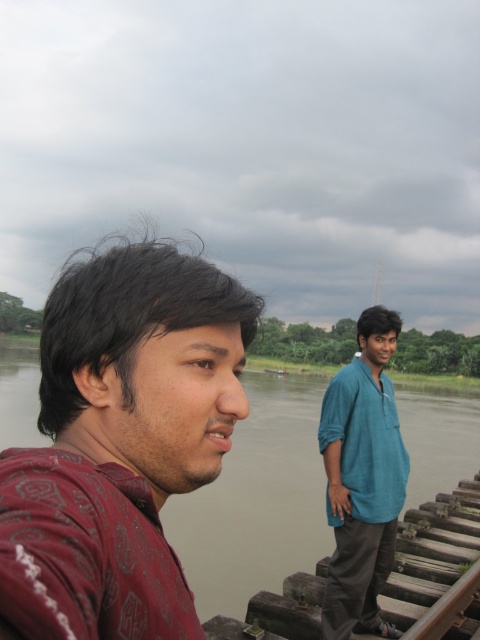
Can you confirm if greenish-brown water at center is positioned above teal cotton shirt at center?

No.

Measure the distance between point [312,561] and camera.

Point [312,561] is 7.48 meters away from camera.

Describe the element at coordinates (256, 500) in the screenshot. This screenshot has width=480, height=640. I see `greenish-brown water at center` at that location.

You are a GUI agent. You are given a task and a screenshot of the screen. Output one action in this format:
    pyautogui.click(x=<x>, y=<y>)
    Task: Click on the greenish-brown water at center
    Image resolution: width=480 pixels, height=640 pixels.
    Given the screenshot: What is the action you would take?
    pyautogui.click(x=256, y=500)

Is the position of maroon printed shirt at left less distant than that of greenish-brown water at center?

That is True.

Is maroon printed shirt at left shorter than greenish-brown water at center?

Correct, maroon printed shirt at left is not as tall as greenish-brown water at center.

The width and height of the screenshot is (480, 640). What do you see at coordinates (145, 364) in the screenshot? I see `maroon printed shirt at left` at bounding box center [145, 364].

Image resolution: width=480 pixels, height=640 pixels. Find the location of `maroon printed shirt at left`. maroon printed shirt at left is located at coordinates (x=145, y=364).

Which is more to the right, maroon printed shirt at left or teal cotton shirt at center?

From the viewer's perspective, teal cotton shirt at center appears more on the right side.

Looking at this image, which is more to the left, maroon printed shirt at left or teal cotton shirt at center?

maroon printed shirt at left is more to the left.

Does point (181, 308) come in front of point (323, 404)?

Yes, point (181, 308) is closer to viewer.

In order to click on maroon printed shirt at left in this screenshot , I will do `click(145, 364)`.